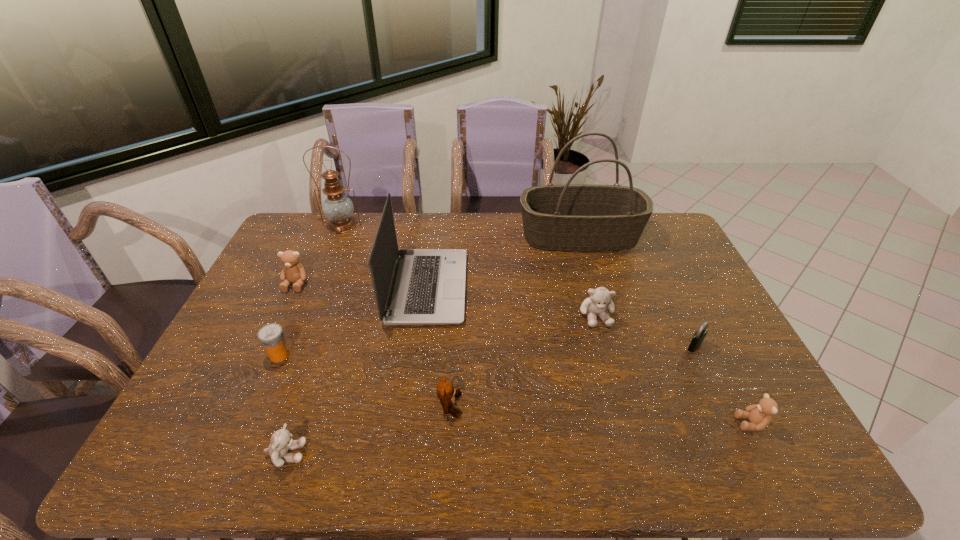
What are the coordinates of `free region located 0.380m on the label side of the medicine` in the screenshot? It's located at (428, 355).

You are a GUI agent. You are given a task and a screenshot of the screen. Output one action in this format:
    pyautogui.click(x=<x>, y=<y>)
    Task: Click on the vacant area situated 0.050m on the face of the rightmost teddy bear
    This screenshot has height=540, width=960.
    Given the screenshot: What is the action you would take?
    pyautogui.click(x=716, y=423)

What are the coordinates of `free region located on the face of the rightmost teddy bear` in the screenshot? It's located at (641, 423).

Find the location of `free region located on the face of the rightmost teddy bear`. free region located on the face of the rightmost teddy bear is located at coordinates (625, 423).

Find the location of a particular element. vacant space located on the face of the nearer gray teddy bear is located at coordinates (461, 454).

Locate an element on the screen. basket at the far edge is located at coordinates point(574,217).

The height and width of the screenshot is (540, 960). Find the location of `oil lamp located in the far edge section of the desktop`. oil lamp located in the far edge section of the desktop is located at coordinates (338, 208).

This screenshot has width=960, height=540. I want to click on object at the near edge, so click(281, 442).

The width and height of the screenshot is (960, 540). Find the location of `oil lamp situated at the left edge`. oil lamp situated at the left edge is located at coordinates (338, 208).

What are the coordinates of `teddy bear located at the left edge` in the screenshot? It's located at (292, 272).